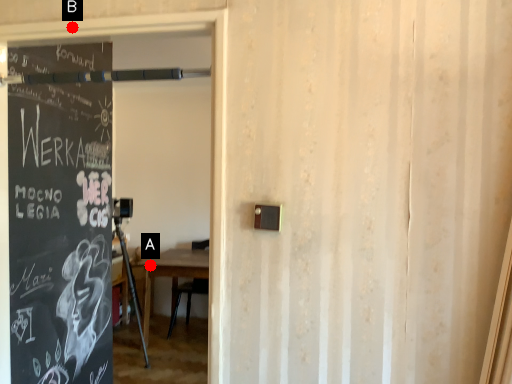
Question: Two points are circled on the image, labeled by A and B beside each circle. Which point is closer to the camera?

Choices:
 (A) A is closer
 (B) B is closer

Answer: (B)